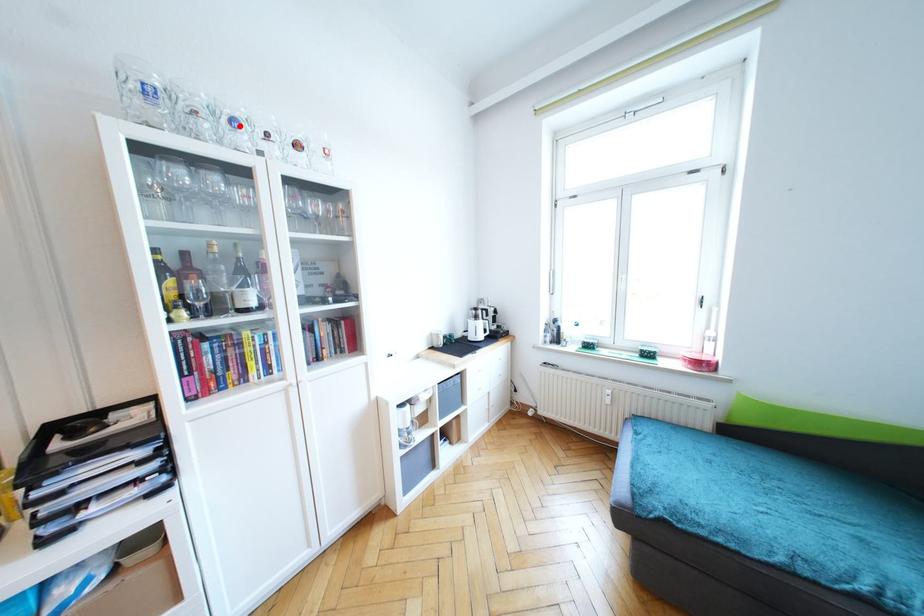
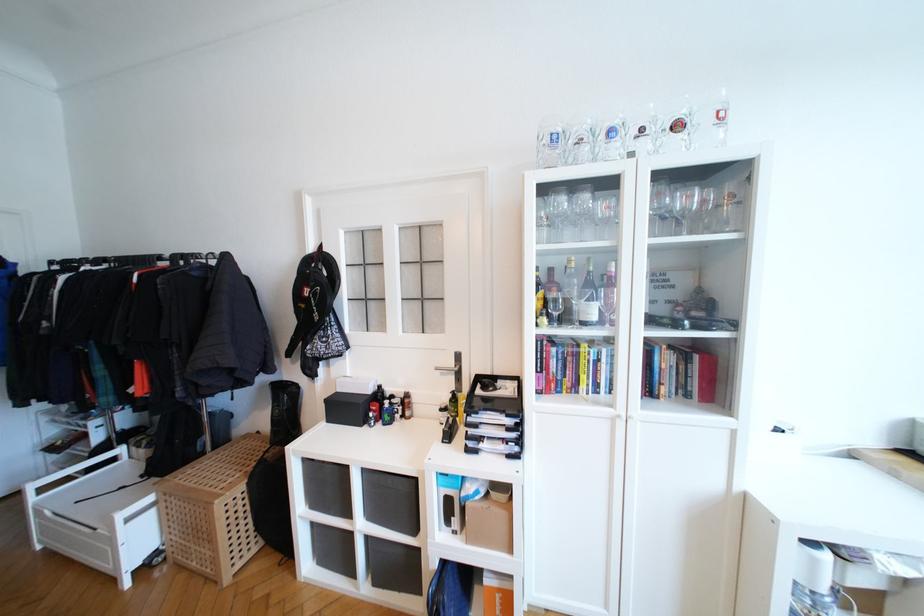
The point at the highlighted location is marked in the first image. Where is the corresponding point in the second image?

(616, 136)